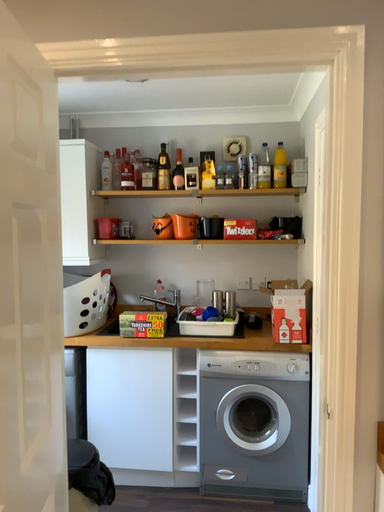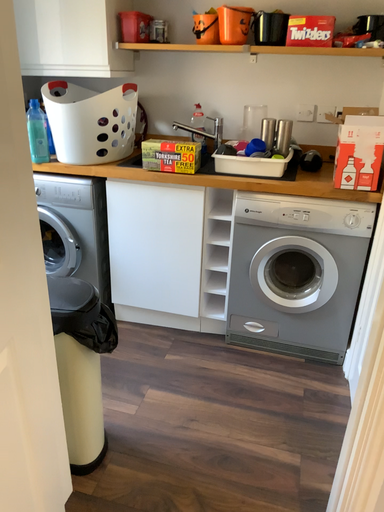
Question: How did the camera likely rotate when shooting the video?

Choices:
 (A) rotated upward
 (B) rotated downward

Answer: (B)